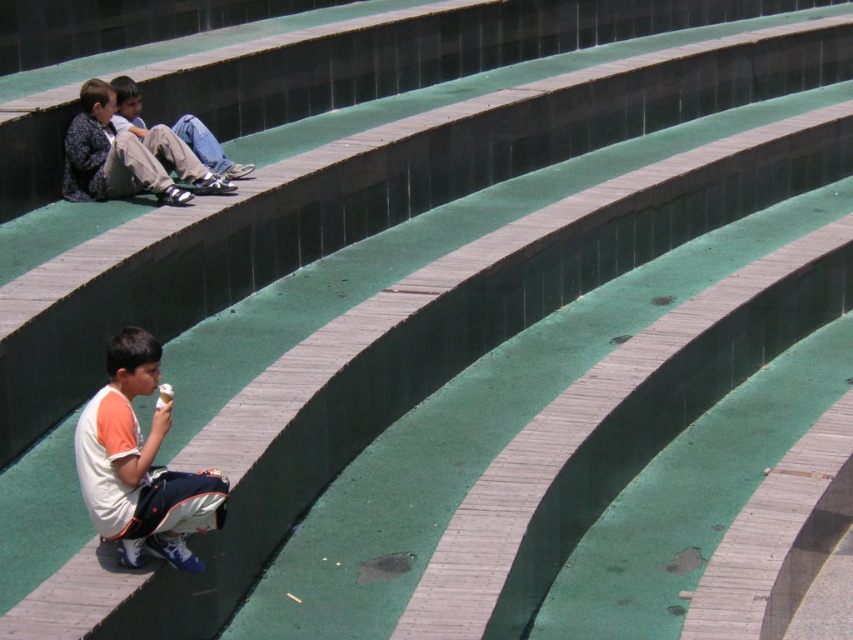
Can you confirm if matte black jacket at upper left is taller than jeans at upper left?

Yes.

Measure the distance between matte black jacket at upper left and camera.

11.31 meters

Find the location of a particular element. Image resolution: width=853 pixels, height=640 pixels. matte black jacket at upper left is located at coordinates (122, 156).

Is white cotton shirt at lower left thinner than matte black jacket at upper left?

Indeed, white cotton shirt at lower left has a lesser width compared to matte black jacket at upper left.

At what (x,y) coordinates should I click in order to perform the action: click on white cotton shirt at lower left. Please return your answer as a coordinate pair (x, y). The height and width of the screenshot is (640, 853). Looking at the image, I should click on (138, 465).

Identify the location of white cotton shirt at lower left. This screenshot has height=640, width=853. (138, 465).

Between jeans at upper left and white paper ice cream cone at lower left, which one appears on the left side from the viewer's perspective?

jeans at upper left is more to the left.

Is point (212, 138) positioned in front of point (165, 404)?

No, (212, 138) is behind (165, 404).

Locate an element on the screen. jeans at upper left is located at coordinates (207, 147).